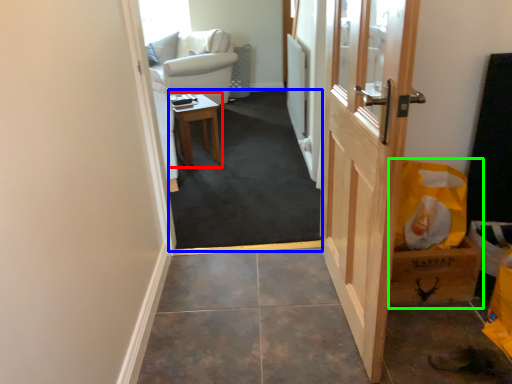
Question: Estimate the real-world distances between objects in this image. Which object is closer to table (highlighted by a red box), corridor (highlighted by a blue box) or cardboard box (highlighted by a green box)?

Choices:
 (A) corridor
 (B) cardboard box

Answer: (A)